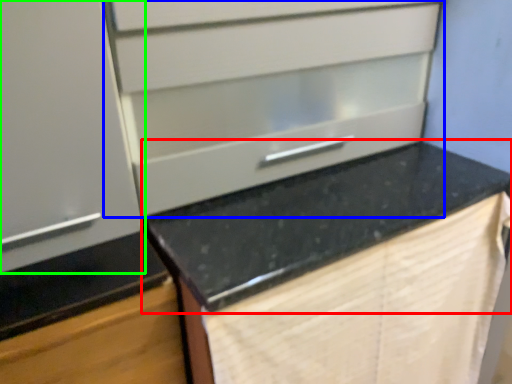
Question: Considering the real-world distances, which object is farthest from countertop (highlighted by a red box)? drawer (highlighted by a blue box) or cabinetry (highlighted by a green box)?

Choices:
 (A) drawer
 (B) cabinetry

Answer: (B)